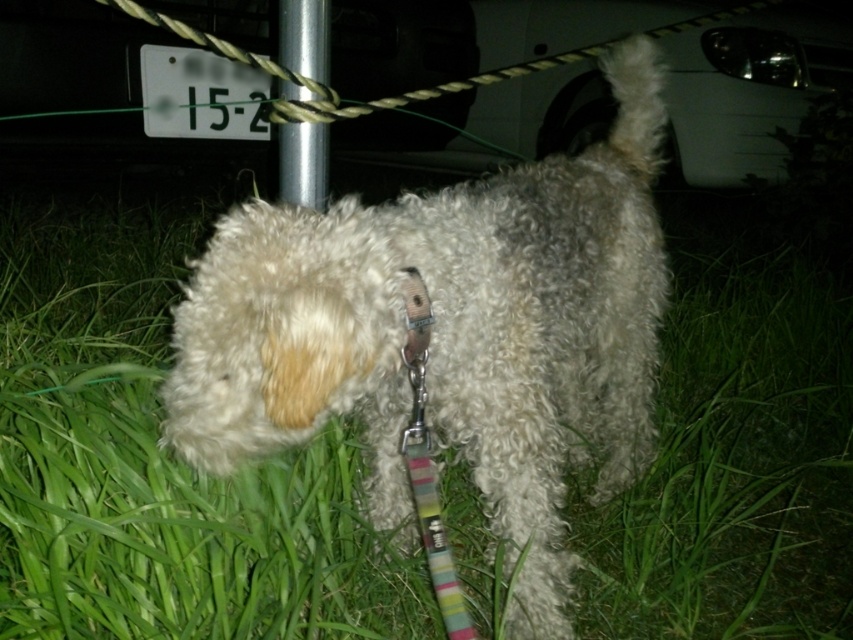
Which of these two, fuzzy white dog at center or silver metallic pole at center, stands taller?

With more height is fuzzy white dog at center.

Is fuzzy white dog at center below silver metallic pole at center?

Yes, fuzzy white dog at center is below silver metallic pole at center.

Locate an element on the screen. The width and height of the screenshot is (853, 640). fuzzy white dog at center is located at coordinates (448, 333).

Identify the location of fuzzy white dog at center. The height and width of the screenshot is (640, 853). (448, 333).